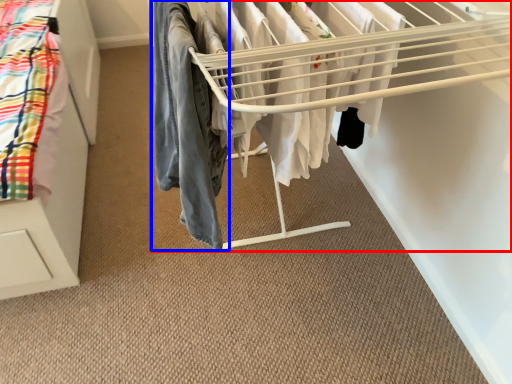
Question: Which object appears closest to the camera in this image, bunk bed (highlighted by a red box) or clothing (highlighted by a blue box)?

Choices:
 (A) bunk bed
 (B) clothing

Answer: (A)